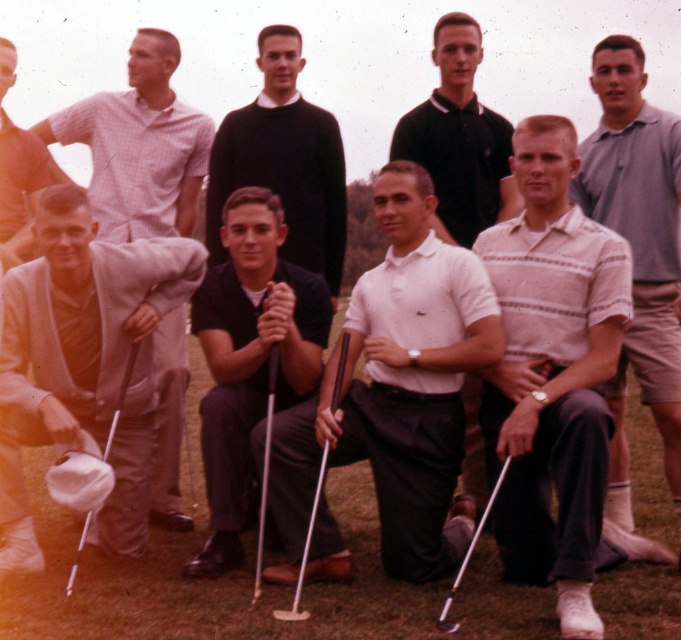
Question: Which of the following is the farthest from the observer?

Choices:
 (A) metallic silver golf club at lower center
 (B) white matte golf club at center
 (C) light brown wool sweater at lower left

Answer: (C)

Question: Is dark blue sweater at center to the right of metallic silver golf club at lower center from the viewer's perspective?

Choices:
 (A) no
 (B) yes

Answer: (A)

Question: Is white matte polo shirt at center to the left of white matte golf club at lower left from the viewer's perspective?

Choices:
 (A) no
 (B) yes

Answer: (A)

Question: Which point appears closest to the camera in this image?

Choices:
 (A) (516, 573)
 (B) (20, 237)
 (C) (437, 339)

Answer: (A)

Question: Which point is farther to the camera?

Choices:
 (A) metallic silver golf club at lower center
 (B) light brown wool sweater at lower left
 (C) white striped polo shirt at center
 (D) white matte polo shirt at center

Answer: (D)

Question: Is light brown wool sweater at lower left further to camera compared to white matte golf club at lower left?

Choices:
 (A) yes
 (B) no

Answer: (A)